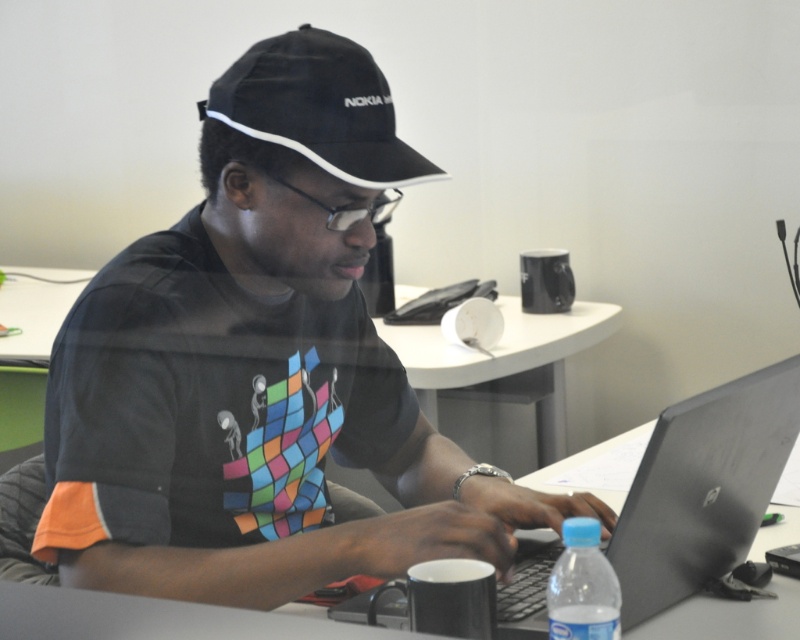
Question: Based on their relative distances, which object is farther from the clear plastic bottle at lower center?

Choices:
 (A) matte black cap at upper center
 (B) silver metallic laptop at center
 (C) black fabric baseball hat at upper center
 (D) white glossy table at center

Answer: (D)

Question: Which object appears farthest from the camera in this image?

Choices:
 (A) matte black cap at upper center
 (B) silver metallic laptop at center
 (C) clear plastic bottle at lower center

Answer: (A)

Question: Which point is farther from the camera taking this photo?

Choices:
 (A) (666, 589)
 (B) (604, 634)

Answer: (A)

Question: Is silver metallic laptop at center behind black fabric baseball hat at upper center?

Choices:
 (A) yes
 (B) no

Answer: (B)

Question: Can you confirm if silver metallic laptop at center is smaller than white glossy table at center?

Choices:
 (A) yes
 (B) no

Answer: (A)

Question: Is black fabric baseball hat at upper center above clear plastic bottle at lower center?

Choices:
 (A) no
 (B) yes

Answer: (B)